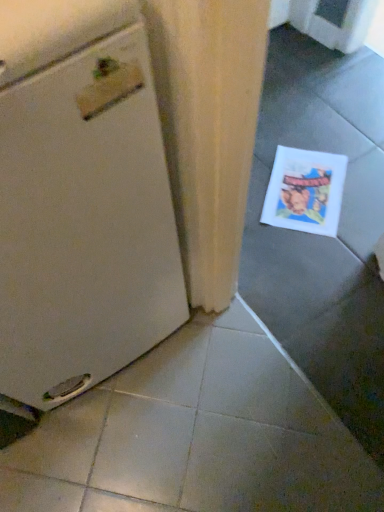
Question: Is the position of white matte refrigerator at left less distant than that of white paper comic book at lower right?

Choices:
 (A) no
 (B) yes

Answer: (B)

Question: Considering the relative positions of white matte refrigerator at left and white paper comic book at lower right in the image provided, is white matte refrigerator at left to the left of white paper comic book at lower right from the viewer's perspective?

Choices:
 (A) no
 (B) yes

Answer: (B)

Question: Does white matte refrigerator at left have a smaller size compared to white paper comic book at lower right?

Choices:
 (A) no
 (B) yes

Answer: (A)

Question: From a real-world perspective, is white matte refrigerator at left beneath white paper comic book at lower right?

Choices:
 (A) yes
 (B) no

Answer: (B)

Question: Considering the relative sizes of white matte refrigerator at left and white paper comic book at lower right in the image provided, is white matte refrigerator at left shorter than white paper comic book at lower right?

Choices:
 (A) no
 (B) yes

Answer: (A)

Question: Considering the relative sizes of white matte refrigerator at left and white paper comic book at lower right in the image provided, is white matte refrigerator at left wider than white paper comic book at lower right?

Choices:
 (A) yes
 (B) no

Answer: (A)

Question: From a real-world perspective, is white paper comic book at lower right under white matte refrigerator at left?

Choices:
 (A) no
 (B) yes

Answer: (B)

Question: From the image's perspective, would you say white paper comic book at lower right is positioned over white matte refrigerator at left?

Choices:
 (A) no
 (B) yes

Answer: (B)

Question: Is white paper comic book at lower right to the left of white matte refrigerator at left from the viewer's perspective?

Choices:
 (A) no
 (B) yes

Answer: (A)

Question: Is white paper comic book at lower right smaller than white matte refrigerator at left?

Choices:
 (A) no
 (B) yes

Answer: (B)

Question: From the image's perspective, is white paper comic book at lower right beneath white matte refrigerator at left?

Choices:
 (A) yes
 (B) no

Answer: (B)

Question: Considering the relative sizes of white paper comic book at lower right and white matte refrigerator at left in the image provided, is white paper comic book at lower right taller than white matte refrigerator at left?

Choices:
 (A) yes
 (B) no

Answer: (B)

Question: From a real-world perspective, is white paper comic book at lower right positioned above or below white matte refrigerator at left?

Choices:
 (A) above
 (B) below

Answer: (B)